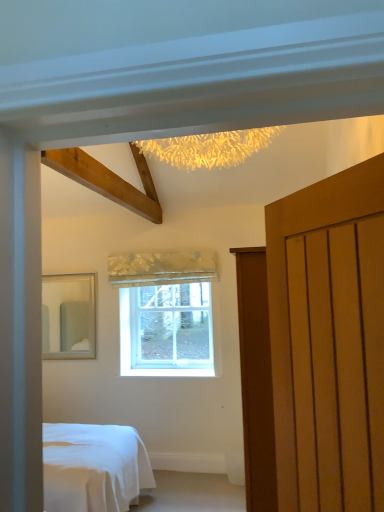
Question: Looking at the image, does matte silver mirror at left seem bigger or smaller compared to matte wooden door at right?

Choices:
 (A) big
 (B) small

Answer: (B)

Question: Relative to matte wooden door at right, is matte silver mirror at left in front or behind?

Choices:
 (A) behind
 (B) front

Answer: (A)

Question: Estimate the real-world distances between objects in this image. Which object is closer to the clear glass window at center?

Choices:
 (A) matte wooden door at right
 (B) silky gold curtain at center
 (C) matte silver mirror at left

Answer: (B)

Question: Considering the real-world distances, which object is closest to the matte wooden door at right?

Choices:
 (A) matte silver mirror at left
 (B) clear glass window at center
 (C) silky gold curtain at center

Answer: (C)